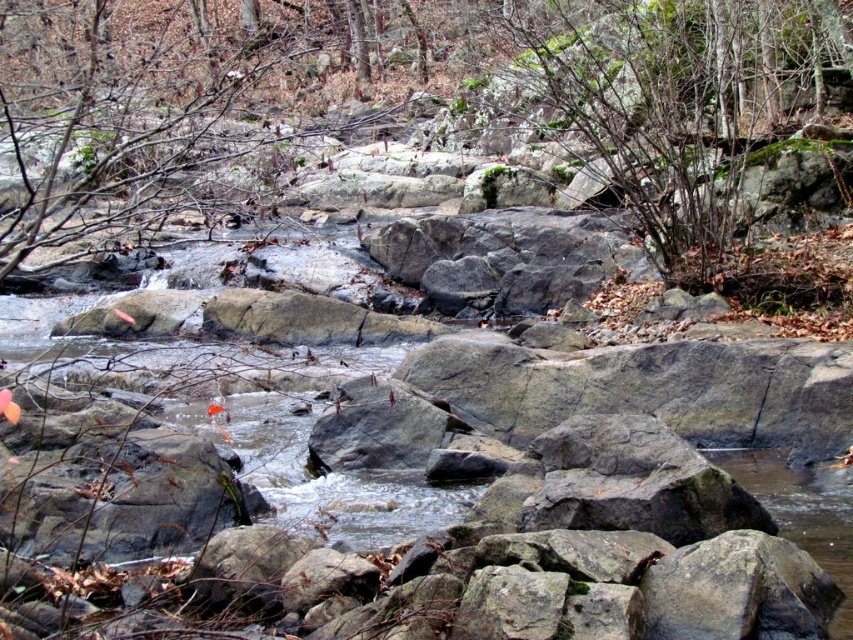
You are a hiker trying to cross the stream and need to step on the green mossy rock at center and the green mossy shrub at upper center. Which one is taller and safer to step on?

The green mossy rock at center is taller than the green mossy shrub at upper center, so it would be safer to step on the green mossy rock at center since it has a greater height.

You are standing at the edge of the rocky stream in the forest. You see a point marked at coordinates (660, 92). What object is located at that point?

The point at coordinates (660, 92) indicates a green mossy rock at center.